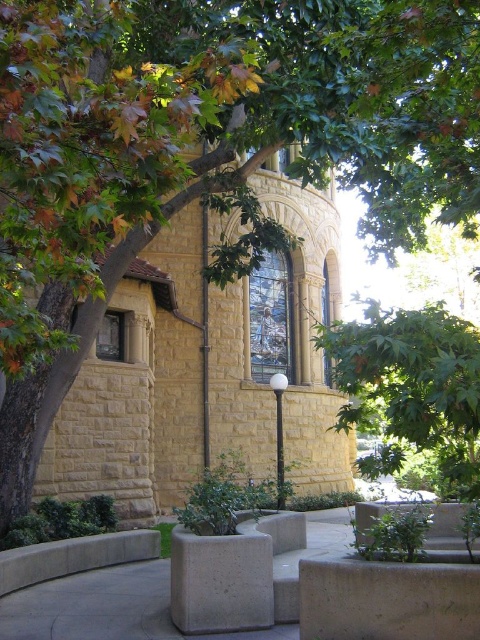
Question: Can you confirm if yellow stone church at center is positioned above gray concrete planter at lower center?

Choices:
 (A) no
 (B) yes

Answer: (B)

Question: Which point is farther to the camera?

Choices:
 (A) gray concrete planter at center
 (B) yellow stone church at center

Answer: (B)

Question: Is green leafy tree at center wider than gray concrete planter at center?

Choices:
 (A) no
 (B) yes

Answer: (B)

Question: Is green leafy tree at center to the left of gray concrete planter at lower center from the viewer's perspective?

Choices:
 (A) no
 (B) yes

Answer: (A)

Question: Which of the following is the closest to the observer?

Choices:
 (A) [x=446, y=632]
 (B) [x=351, y=326]
 (C) [x=303, y=244]
 (D) [x=172, y=614]

Answer: (A)

Question: Which object appears farthest from the camera in this image?

Choices:
 (A) gray concrete planter at lower center
 (B) green leafy tree at center
 (C) gray concrete planter at center
 (D) yellow stone church at center

Answer: (D)